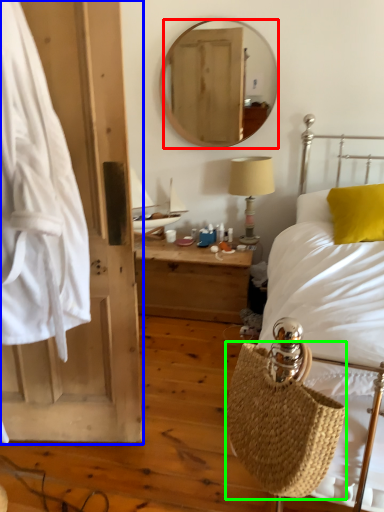
Question: Based on their relative distances, which object is nearer to mirror (highlighted by a red box)? Choose from barn door (highlighted by a blue box) and basket (highlighted by a green box).

Choices:
 (A) barn door
 (B) basket

Answer: (A)